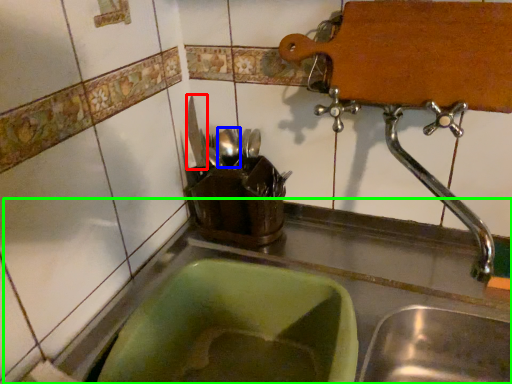
Question: Which object is positioned farthest from tableware (highlighted by a red box)? Select from tableware (highlighted by a blue box) and counter top (highlighted by a green box).

Choices:
 (A) tableware
 (B) counter top

Answer: (B)